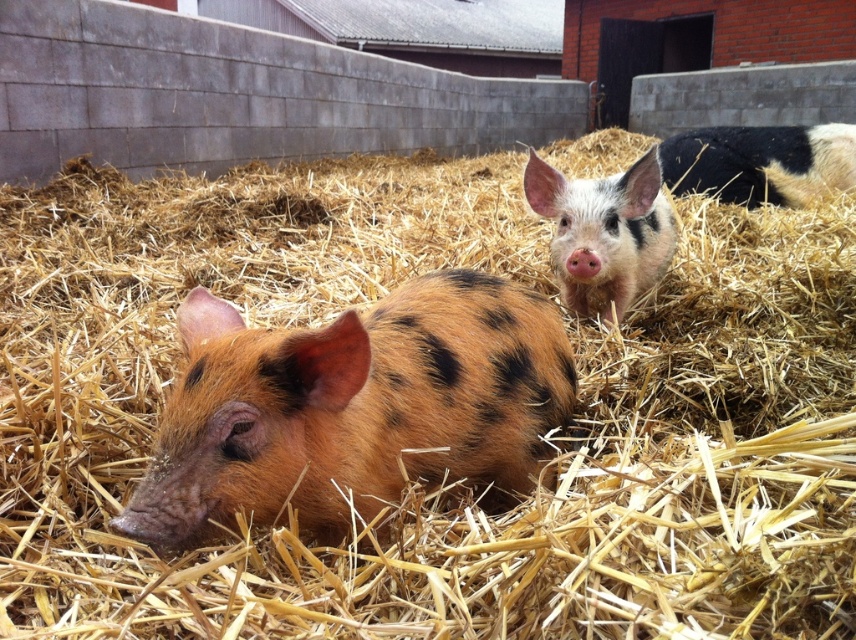
Can you confirm if spotted fur pig at center is wider than spotted fur piglet at center?

Correct, the width of spotted fur pig at center exceeds that of spotted fur piglet at center.

Is point (455, 435) farther from viewer compared to point (610, 248)?

No.

What do you see at coordinates (352, 406) in the screenshot?
I see `spotted fur pig at center` at bounding box center [352, 406].

Locate an element on the screen. The width and height of the screenshot is (856, 640). spotted fur pig at center is located at coordinates (352, 406).

Which of these two, spotted fur piglet at center or black and white spotted pig at upper right, stands shorter?

spotted fur piglet at center

Is point (667, 236) more distant than point (810, 132)?

No, it is not.

You are a GUI agent. You are given a task and a screenshot of the screen. Output one action in this format:
    pyautogui.click(x=<x>, y=<y>)
    Task: Click on the spotted fur piglet at center
    This screenshot has height=640, width=856.
    Given the screenshot: What is the action you would take?
    pyautogui.click(x=604, y=230)

At what (x,y) coordinates should I click in order to perform the action: click on spotted fur piglet at center. Please return your answer as a coordinate pair (x, y). Image resolution: width=856 pixels, height=640 pixels. Looking at the image, I should click on (604, 230).

Does point (295, 426) come behind point (800, 179)?

No.

Between spotted fur pig at center and black and white spotted pig at upper right, which one has less height?

Standing shorter between the two is spotted fur pig at center.

The width and height of the screenshot is (856, 640). What are the coordinates of `spotted fur pig at center` in the screenshot? It's located at (352, 406).

What are the coordinates of `spotted fur pig at center` in the screenshot? It's located at (352, 406).